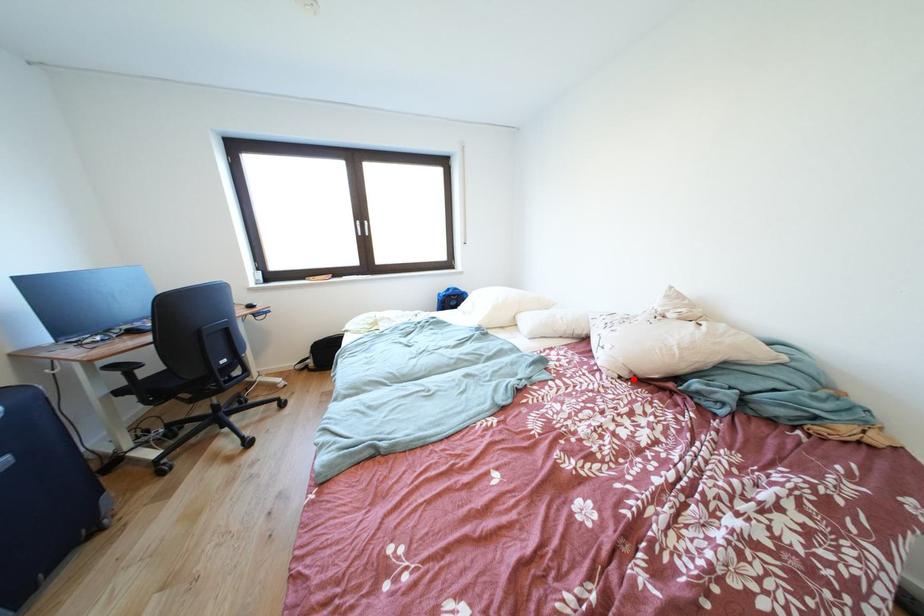
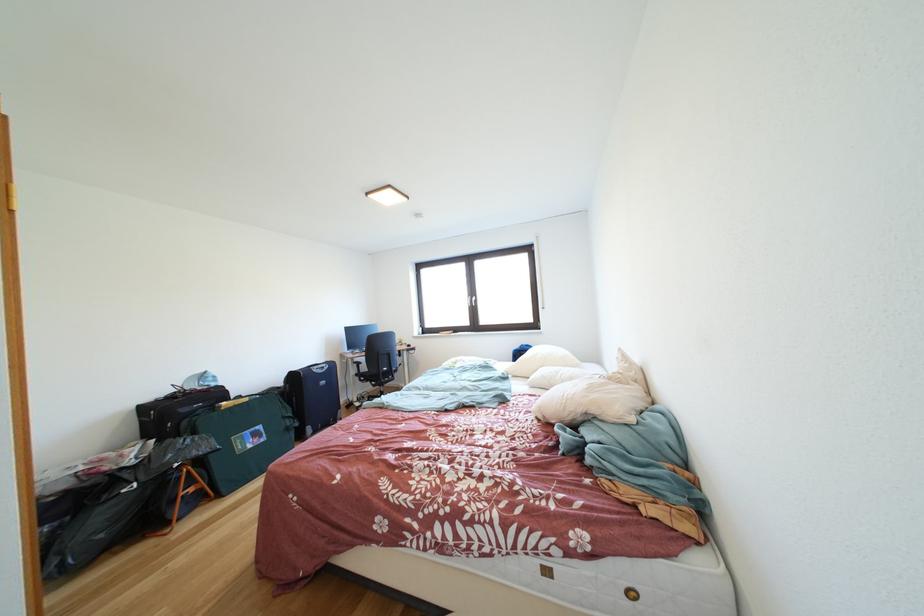
The point at the highlighted location is marked in the first image. Where is the corresponding point in the second image?

(549, 421)